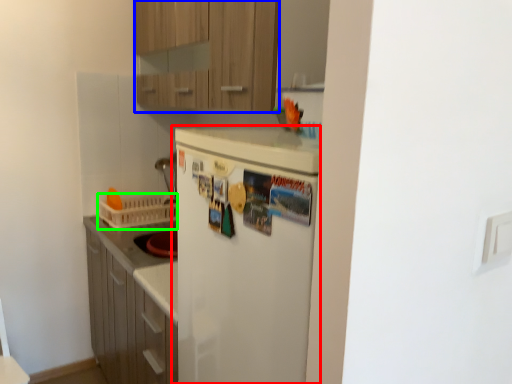
Question: Which object is positioned farthest from refrigerator (highlighted by a red box)? Select from cabinetry (highlighted by a blue box) and basket (highlighted by a green box).

Choices:
 (A) cabinetry
 (B) basket

Answer: (B)